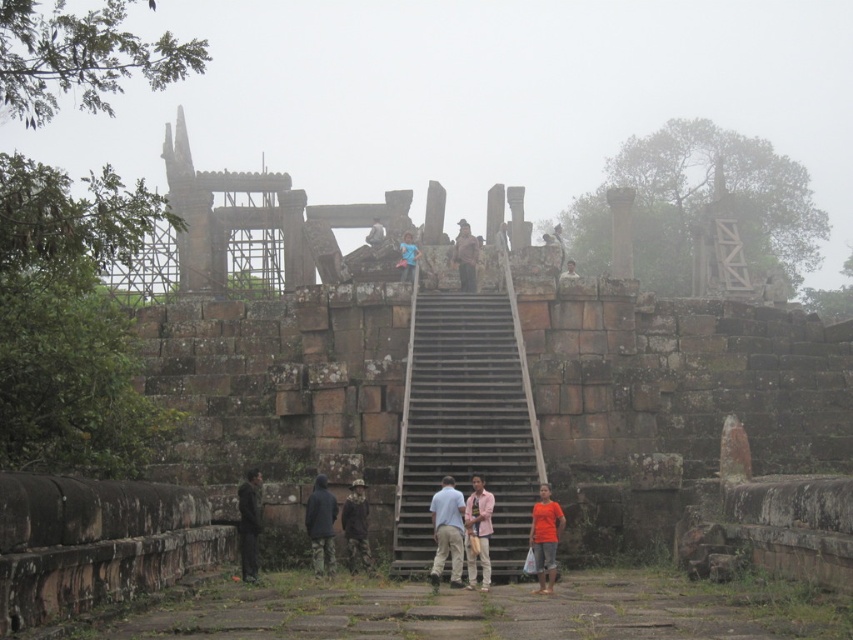
Based on the photo, you are standing at the base of the ancient stone structure and want to locate the brown stone stairs at center. According to the coordinates provided, where exactly would you find them?

The brown stone stairs at center are located at the 2D coordinates point (x=465, y=424).

You are a photographer trying to capture a clear image of the light pink shirt at center and the dark gray fabric jacket at lower left. Since the scene is foggy, you want to ensure both are visible. Which object should you focus on first to ensure it appears sharp in the photo?

The light pink shirt at center is positioned over the dark gray fabric jacket at lower left. To ensure both appear sharp, focus on the light pink shirt at center first since it is closer to the camera, and the jacket will also be in focus if within the depth of field.